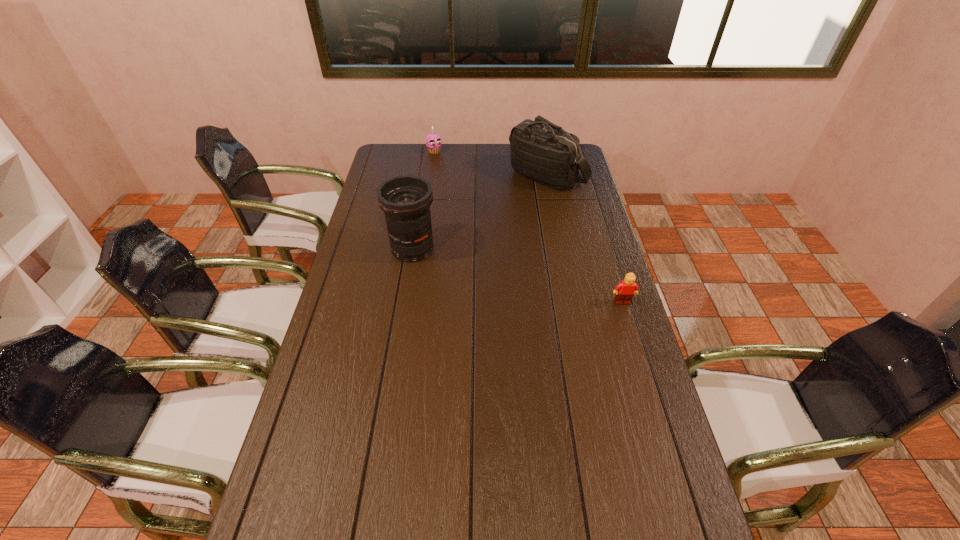
Locate an element on the screen. The width and height of the screenshot is (960, 540). vacant space located on the face of the farthest object is located at coordinates (441, 160).

This screenshot has width=960, height=540. Find the location of `vacant space located on the face of the farthest object`. vacant space located on the face of the farthest object is located at coordinates pyautogui.click(x=459, y=188).

You are a GUI agent. You are given a task and a screenshot of the screen. Output one action in this format:
    pyautogui.click(x=<x>, y=<y>)
    Task: Click on the shoulder bag that is at the far edge
    The width and height of the screenshot is (960, 540).
    Given the screenshot: What is the action you would take?
    pyautogui.click(x=541, y=151)

Find the location of a particular element. cupcake at the far edge is located at coordinates (433, 140).

You are a GUI agent. You are given a task and a screenshot of the screen. Output one action in this format:
    pyautogui.click(x=<x>, y=<y>)
    Task: Click on the object situated at the left edge
    This screenshot has height=540, width=960.
    Given the screenshot: What is the action you would take?
    pyautogui.click(x=406, y=200)

This screenshot has height=540, width=960. I want to click on Lego that is at the right edge, so click(x=625, y=290).

Locate an element on the screen. shoulder bag located in the right edge section of the desktop is located at coordinates (541, 151).

This screenshot has height=540, width=960. In order to click on object that is positioned at the far right corner in this screenshot , I will do `click(541, 151)`.

Find the location of a particular element. The image size is (960, 540). free point at the far edge is located at coordinates (491, 151).

I want to click on vacant space at the left edge, so click(396, 172).